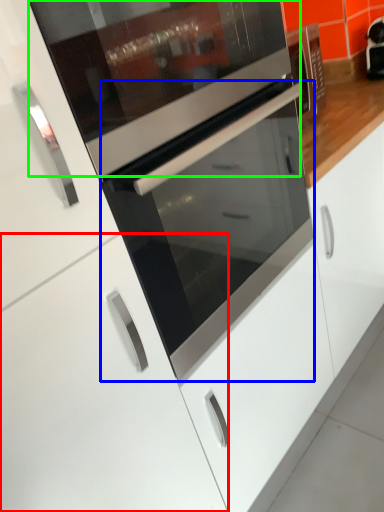
Question: Estimate the real-world distances between objects in this image. Which object is farther from cabinetry (highlighted by a red box), oven (highlighted by a blue box) or appliance (highlighted by a green box)?

Choices:
 (A) oven
 (B) appliance

Answer: (B)